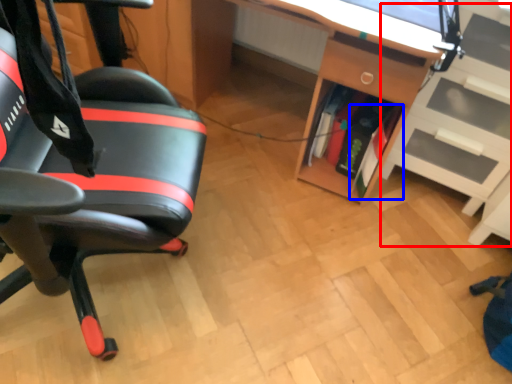
Question: Which object is further to the camera taking this photo, shelf (highlighted by a red box) or book (highlighted by a blue box)?

Choices:
 (A) shelf
 (B) book

Answer: (B)